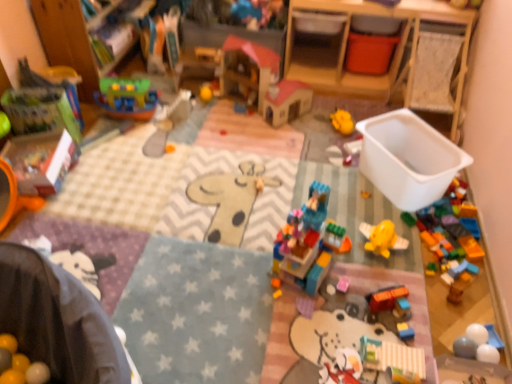
Locate an element on the screen. free space that is to the left of yellow matte ball at center, which is the 8th toy from bottom to top is located at coordinates (172, 94).